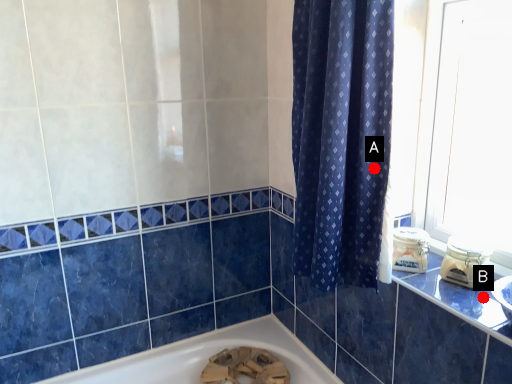
Question: Two points are circled on the image, labeled by A and B beside each circle. Which point is farther to the camera?

Choices:
 (A) A is further
 (B) B is further

Answer: (A)